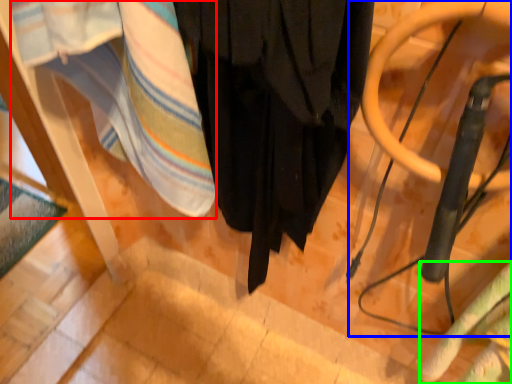
Question: Which is nearer to the blanket (highlighted by a red box)? swivel chair (highlighted by a blue box) or blanket (highlighted by a green box).

Choices:
 (A) swivel chair
 (B) blanket

Answer: (A)